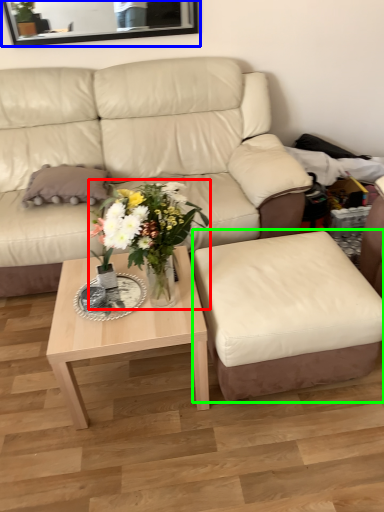
Question: Estimate the real-world distances between objects in this image. Which object is farther from houseplant (highlighted by a red box), mirror (highlighted by a blue box) or swivel chair (highlighted by a green box)?

Choices:
 (A) mirror
 (B) swivel chair

Answer: (A)